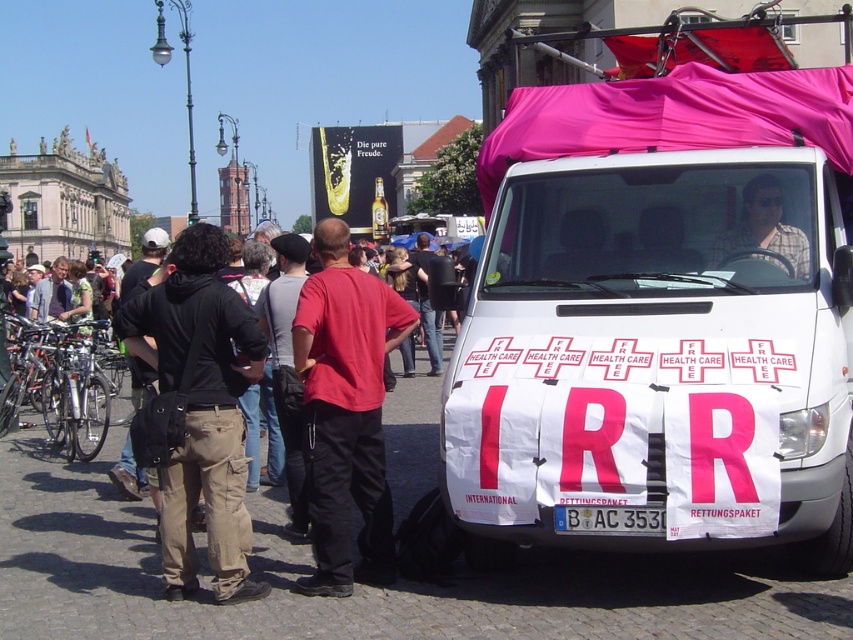
Question: Does black cotton hoodie at left appear over plaid shirt at center?

Choices:
 (A) yes
 (B) no

Answer: (B)

Question: Estimate the real-world distances between objects in this image. Which object is farther from the white fabric van at right?

Choices:
 (A) red cotton shirt at center
 (B) white plastic license plate at center

Answer: (A)

Question: Does red cotton shirt at center appear under plaid shirt at center?

Choices:
 (A) no
 (B) yes

Answer: (B)

Question: Which point appears farthest from the camera in this image?

Choices:
 (A) (157, 339)
 (B) (560, 516)

Answer: (A)

Question: Which object is closer to the camera taking this photo?

Choices:
 (A) white fabric van at right
 (B) white plastic license plate at center

Answer: (A)

Question: Does red cotton shirt at center have a larger size compared to white plastic license plate at center?

Choices:
 (A) yes
 (B) no

Answer: (A)